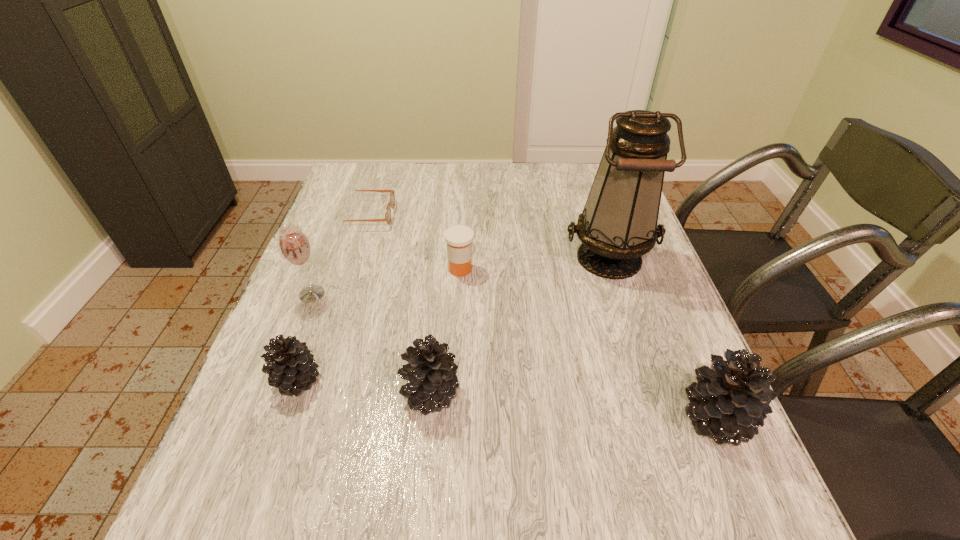
Identify the location of vacant space situated 0.290m on the right of the fourth tallest object. (609, 393).

Identify the location of free space located on the back of the rightmost pinecone. (656, 276).

This screenshot has width=960, height=540. Identify the location of free spot located on the front-facing side of the shortest object. (468, 215).

The width and height of the screenshot is (960, 540). Find the location of `free space located on the front of the tallest object`. free space located on the front of the tallest object is located at coordinates (643, 361).

Identify the location of vacant region located on the label of the medicine. (616, 269).

Identify the location of vacant area located 0.070m on the right of the wineglass. (356, 294).

This screenshot has width=960, height=540. I want to click on object present at the far edge, so click(x=392, y=198).

I want to click on pinecone present at the left edge, so click(291, 367).

What are the coordinates of `sunglasses located in the left edge section of the desktop` in the screenshot? It's located at (392, 198).

Where is `wineglass at the left edge`? wineglass at the left edge is located at coordinates (295, 247).